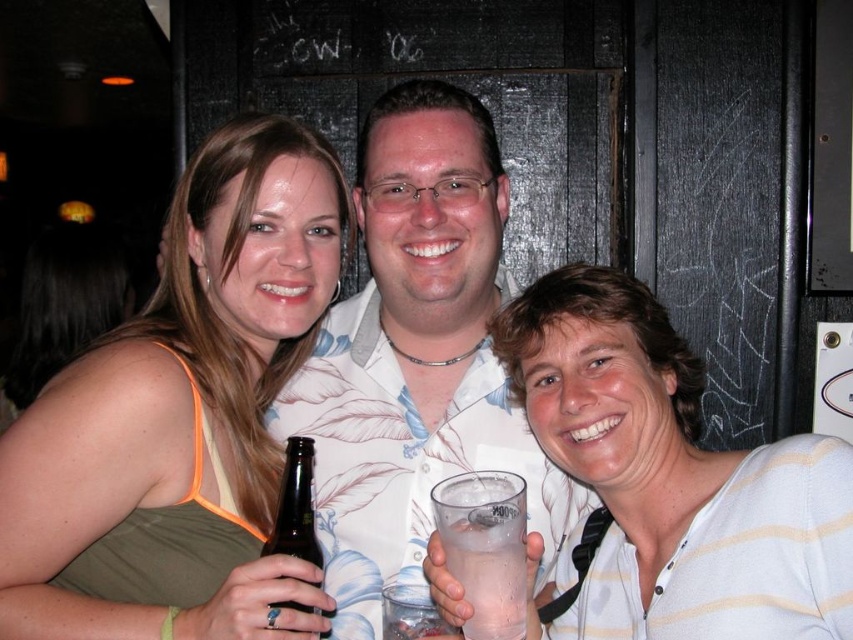
Can you confirm if white striped shirt at center is wider than white floral shirt at center?

Incorrect, white striped shirt at center's width does not surpass white floral shirt at center's.

Who is lower down, white striped shirt at center or white floral shirt at center?

Positioned lower is white striped shirt at center.

Who is more forward, (628, 552) or (573, 518)?

Point (628, 552) is more forward.

Find the location of a particular element. This screenshot has width=853, height=640. white striped shirt at center is located at coordinates (669, 481).

Looking at this image, who is positioned more to the right, green fabric tank top at left or brown glass bottle at lower left?

Positioned to the right is brown glass bottle at lower left.

Is green fabric tank top at left bigger than brown glass bottle at lower left?

Correct, green fabric tank top at left is larger in size than brown glass bottle at lower left.

Locate an element on the screen. green fabric tank top at left is located at coordinates (183, 394).

Describe the element at coordinates (415, 355) in the screenshot. This screenshot has width=853, height=640. I see `white floral shirt at center` at that location.

Is point (410, 508) closer to camera compared to point (318, 586)?

No, (410, 508) is behind (318, 586).

Describe the element at coordinates (415, 355) in the screenshot. I see `white floral shirt at center` at that location.

Find the location of a particular element. The height and width of the screenshot is (640, 853). white floral shirt at center is located at coordinates (415, 355).